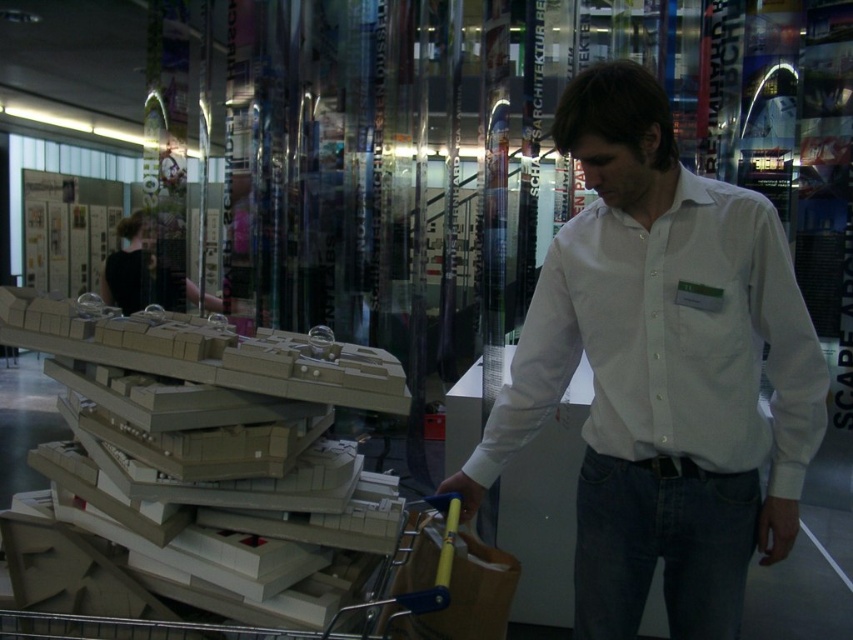
Can you confirm if white cotton shirt at center is wider than beige cardboard stack at center?

Incorrect, white cotton shirt at center's width does not surpass beige cardboard stack at center's.

Can you confirm if white cotton shirt at center is positioned above beige cardboard stack at center?

Yes.

What do you see at coordinates (662, 371) in the screenshot? This screenshot has height=640, width=853. I see `white cotton shirt at center` at bounding box center [662, 371].

Image resolution: width=853 pixels, height=640 pixels. I want to click on white cotton shirt at center, so pyautogui.click(x=662, y=371).